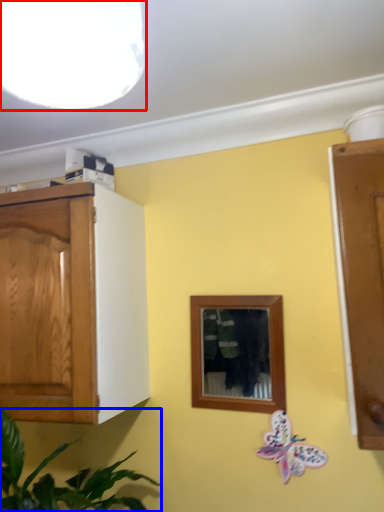
Question: Which object appears farthest to the camera in this image, light fixture (highlighted by a red box) or houseplant (highlighted by a blue box)?

Choices:
 (A) light fixture
 (B) houseplant

Answer: (B)